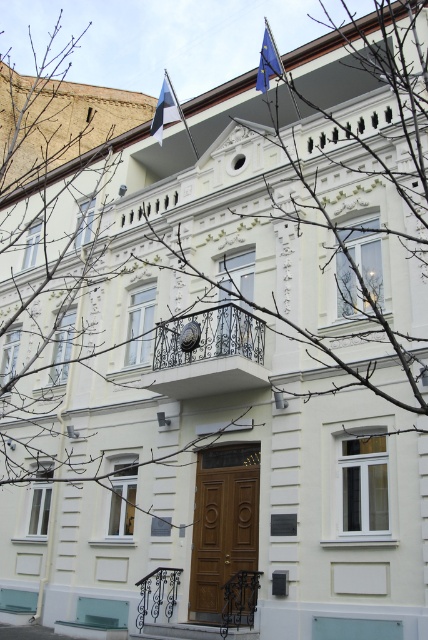
Can you confirm if blue and white striped flag at upper center is wider than blue fabric flag at upper center?

Yes, blue and white striped flag at upper center is wider than blue fabric flag at upper center.

Is point (163, 81) farther from camera compared to point (275, 58)?

Yes, it is.

Locate an element on the screen. This screenshot has height=640, width=428. blue and white striped flag at upper center is located at coordinates (165, 109).